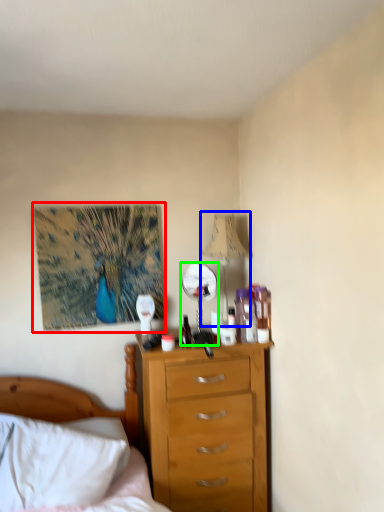
Question: Which object is the closest to the picture frame (highlighted by a red box)? Choose among these: lamp (highlighted by a blue box) or mirror (highlighted by a green box).

Choices:
 (A) lamp
 (B) mirror

Answer: (B)